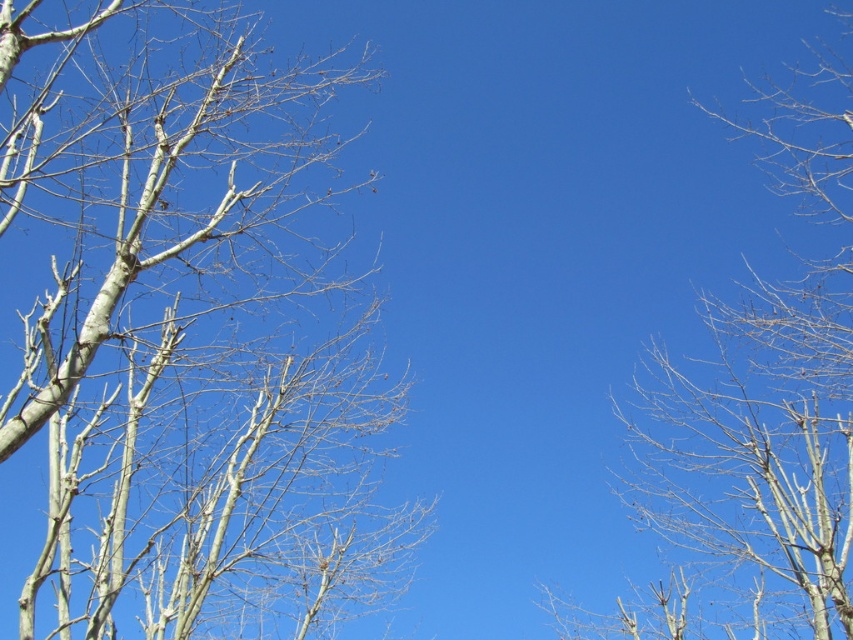
You are standing in a field with the white bark tree at left and the bare branches at right. You want to place a 10 feet long fence between them. Will the fence fit between the two?

The distance between the white bark tree at left and the bare branches at right is 9.16 feet. Since the fence is 10 feet long, it will not fit between them as the distance is shorter than the fence length.

Consider the image. You are standing in a field looking at the white bark tree at left. If you walk straight ahead, will you eventually see the tree in your line of sight?

The white bark tree at left is located at point (x=186, y=333), so if you walk straight ahead, you might not see it in your line of sight since it is positioned to the left side of the scene.

You are standing in a field with several leafless trees. You notice a point marked at coordinates [186,333]. Which tree does this point correspond to?

The point at coordinates [186,333] corresponds to the white bark tree at left.